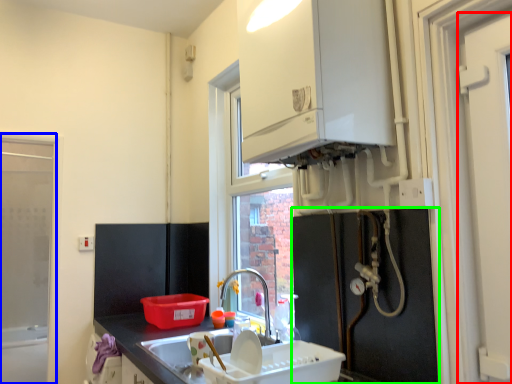
Question: Estimate the real-world distances between objects in this image. Which object is farther from door (highlighted by a red box), window frame (highlighted by a blue box) or appliance (highlighted by a green box)?

Choices:
 (A) window frame
 (B) appliance

Answer: (A)